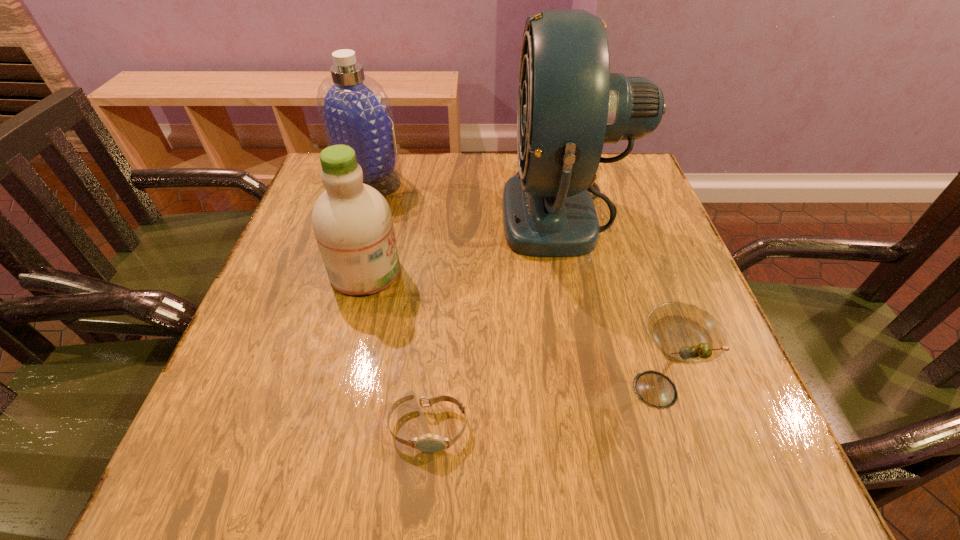
In order to click on free region at the near edge in this screenshot , I will do `click(387, 475)`.

This screenshot has height=540, width=960. In order to click on free space at the left edge in this screenshot , I will do `click(288, 413)`.

In the image, there is a desktop. Identify the location of vacant region at the right edge. (648, 260).

Identify the location of free space at the near left corner of the desktop. The image size is (960, 540). (283, 461).

This screenshot has height=540, width=960. In order to click on vacant space at the far right corner of the desktop in this screenshot , I will do `click(614, 154)`.

Image resolution: width=960 pixels, height=540 pixels. Identify the location of vacant space at the near right corner of the desktop. (780, 475).

In order to click on empty location between the fourth tallest object and the nearer cleansing agent in this screenshot , I will do `click(510, 330)`.

Locate an element on the screen. This screenshot has width=960, height=540. free area in between the farther cleansing agent and the fan is located at coordinates (468, 195).

The width and height of the screenshot is (960, 540). I want to click on free space between the tallest object and the nearer cleansing agent, so click(x=466, y=241).

Image resolution: width=960 pixels, height=540 pixels. I want to click on free point between the farther cleansing agent and the watch, so click(398, 303).